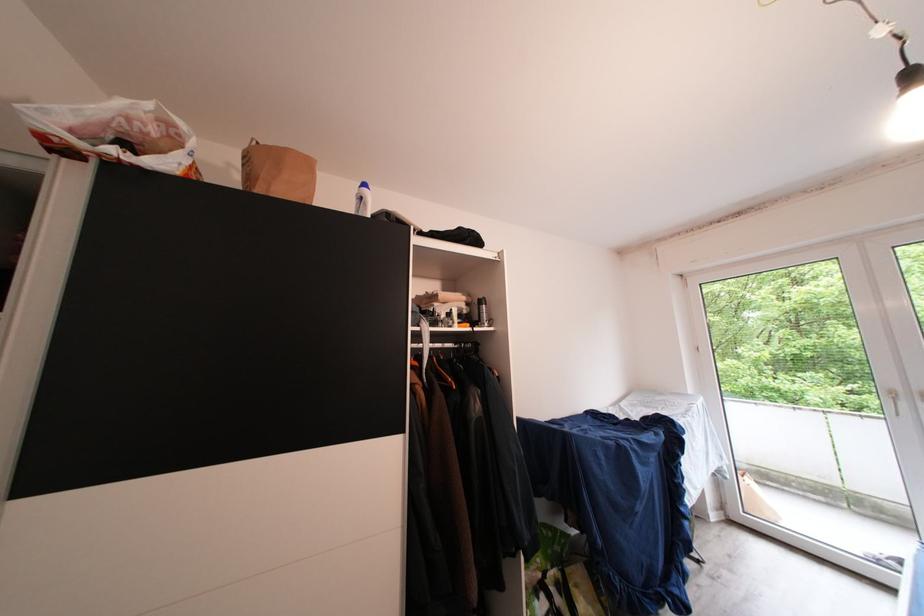
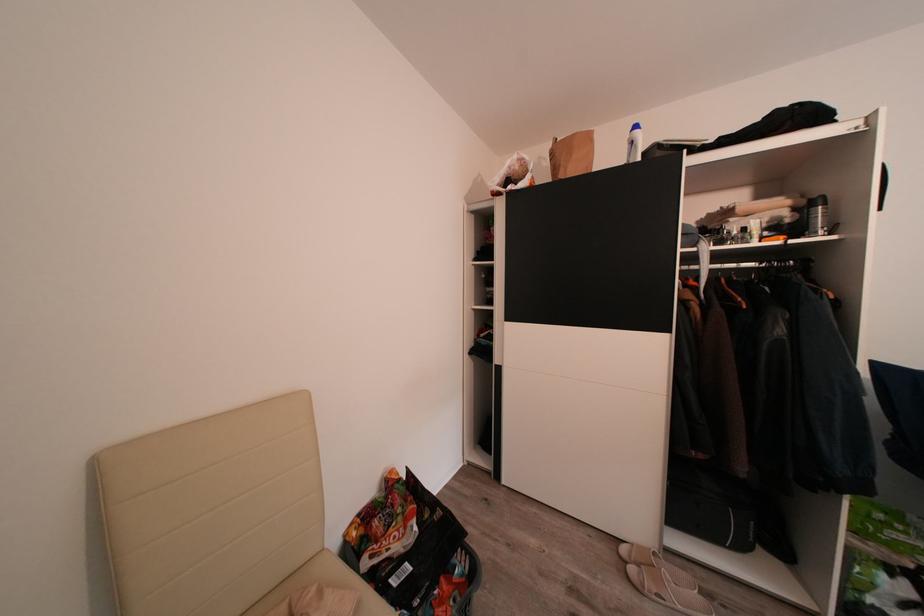
Where in the second image is the point corresponding to point (509, 259) from the first image?

(881, 122)